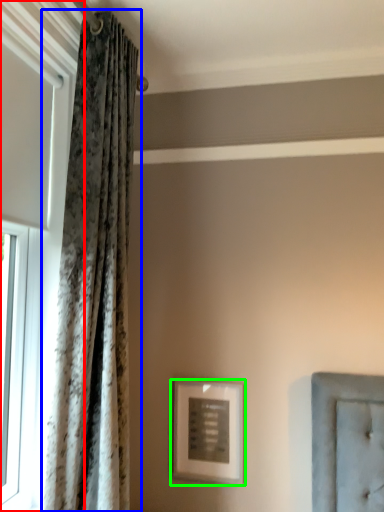
Question: Estimate the real-world distances between objects in this image. Which object is closer to window (highlighted by a red box), curtain (highlighted by a blue box) or picture frame (highlighted by a green box)?

Choices:
 (A) curtain
 (B) picture frame

Answer: (A)